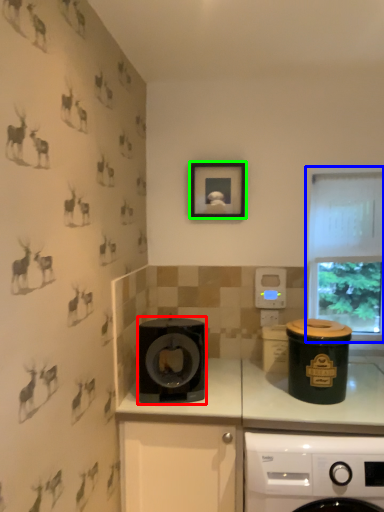
Question: Which is farther away from kitchen appliance (highlighted by a red box)? window (highlighted by a blue box) or picture frame (highlighted by a green box)?

Choices:
 (A) window
 (B) picture frame

Answer: (A)